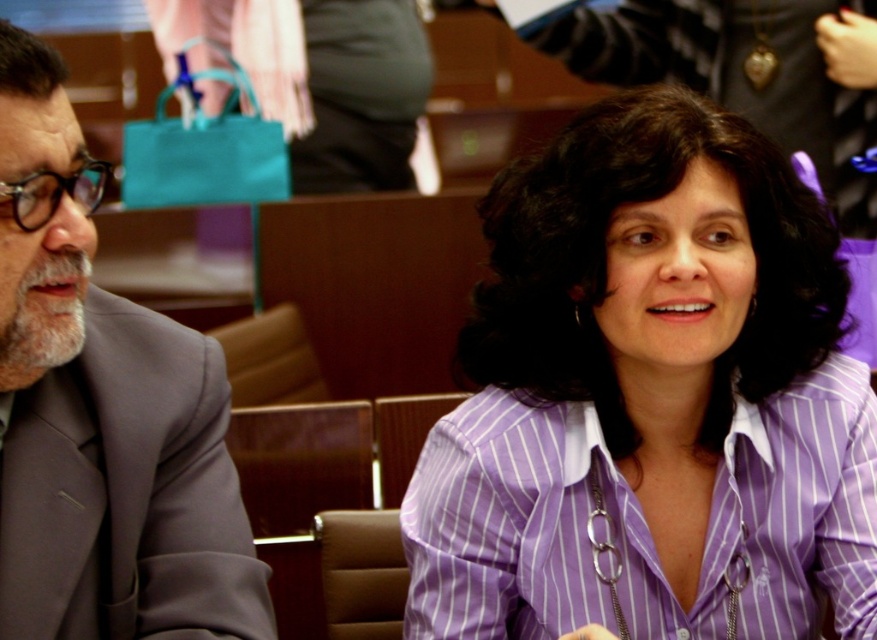
Question: Can you confirm if purple striped shirt at center is wider than matte gray suit at left?

Choices:
 (A) yes
 (B) no

Answer: (A)

Question: Which of the following is the farthest from the observer?

Choices:
 (A) (599, 227)
 (B) (252, 589)

Answer: (A)

Question: Is purple striped shirt at center behind matte gray suit at left?

Choices:
 (A) yes
 (B) no

Answer: (A)

Question: Is purple striped shirt at center wider than matte gray suit at left?

Choices:
 (A) yes
 (B) no

Answer: (A)

Question: Among these objects, which one is farthest from the camera?

Choices:
 (A) matte gray suit at left
 (B) purple striped shirt at center

Answer: (B)

Question: Which of the following is the closest to the observer?

Choices:
 (A) purple striped shirt at center
 (B) matte gray suit at left

Answer: (B)